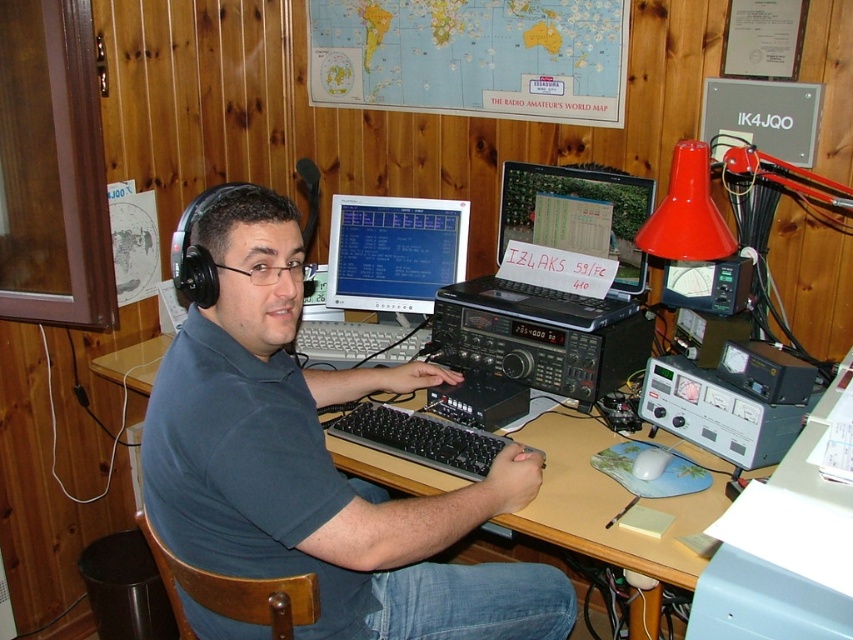
Is matte plastic monitor at center smaller than black plastic keyboard at center?

No, matte plastic monitor at center is not smaller than black plastic keyboard at center.

Measure the distance from matte plastic monitor at center to black plastic keyboard at center.

matte plastic monitor at center and black plastic keyboard at center are 61.93 centimeters apart from each other.

Identify the location of matte plastic monitor at center. point(393,252).

Identify the location of matte plastic monitor at center. The image size is (853, 640). (393, 252).

Between point (299, 480) and point (606, 202), which one is positioned behind?

The point (606, 202) is more distant.

In the scene shown: Who is more forward, (161, 426) or (643, 205)?

Point (161, 426) is in front.

I want to click on dark blue shirt at center, so click(x=316, y=461).

Can you confirm if wooden at center is wider than matte plastic monitor at center?

Indeed, wooden at center has a greater width compared to matte plastic monitor at center.

Describe the element at coordinates (606, 502) in the screenshot. The height and width of the screenshot is (640, 853). I see `wooden at center` at that location.

Who is more distant from viewer, (134, 362) or (437, 284)?

Positioned behind is point (437, 284).

Find the location of a particular element. wooden at center is located at coordinates (606, 502).